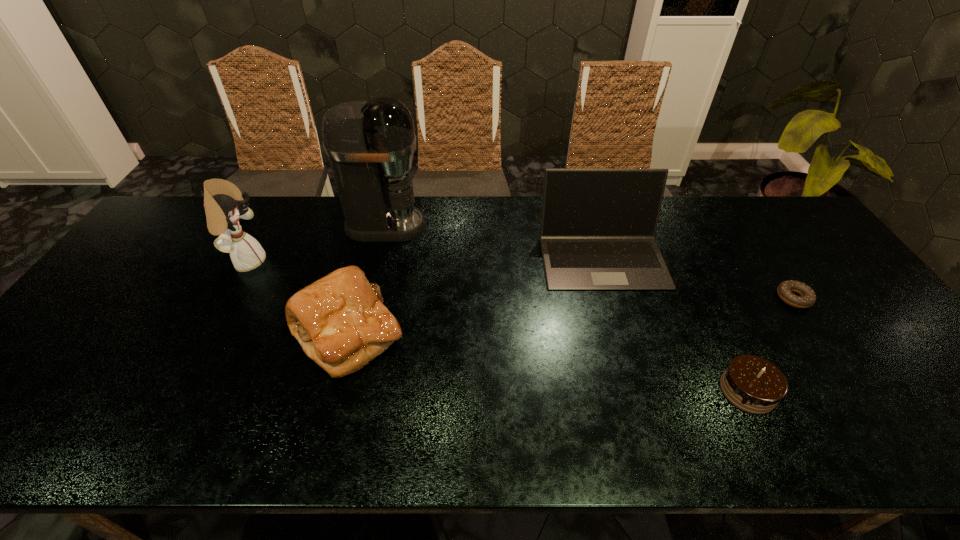
The height and width of the screenshot is (540, 960). In order to click on empty space between the fourth tallest object and the tallest object in this screenshot , I will do `click(368, 280)`.

You are a GUI agent. You are given a task and a screenshot of the screen. Output one action in this format:
    pyautogui.click(x=<x>, y=<y>)
    Task: Click on the free spot between the rightmost object and the doll
    
    Given the screenshot: What is the action you would take?
    pyautogui.click(x=520, y=280)

In order to click on free space between the third object from right to left and the shortest object in this screenshot , I will do `click(698, 277)`.

At what (x,y) coordinates should I click in order to perform the action: click on free space between the leftmost object and the fourth shortest object. Please return your answer as a coordinate pair (x, y). Image resolution: width=960 pixels, height=540 pixels. Looking at the image, I should click on pyautogui.click(x=424, y=259).

Identify which object is the nearest to the bread. Please provide its 2D coordinates. Your answer should be formatted as a tuple, i.e. [(x, y)], where the tuple contains the x and y coordinates of a point satisfying the conditions above.

[(223, 202)]

Image resolution: width=960 pixels, height=540 pixels. I want to click on the second closest object to the coffee maker, so click(340, 321).

This screenshot has height=540, width=960. I want to click on free space that satisfies the following two spatial constraints: 1. at the front face of the doughnut; 2. on the left side of the second tallest object, so click(x=227, y=298).

The height and width of the screenshot is (540, 960). Find the location of `vacant space that satisfies the following two spatial constraints: 1. place cup under the spout of the second object from right to left; 2. on the right side of the tallest object`. vacant space that satisfies the following two spatial constraints: 1. place cup under the spout of the second object from right to left; 2. on the right side of the tallest object is located at coordinates (346, 390).

At what (x,y) coordinates should I click in order to perform the action: click on vacant position in the image that satisfies the following two spatial constraints: 1. on the screen of the fourth shortest object; 2. at the front face of the doll. Please return your answer as a coordinate pair (x, y). This screenshot has height=540, width=960. Looking at the image, I should click on (604, 262).